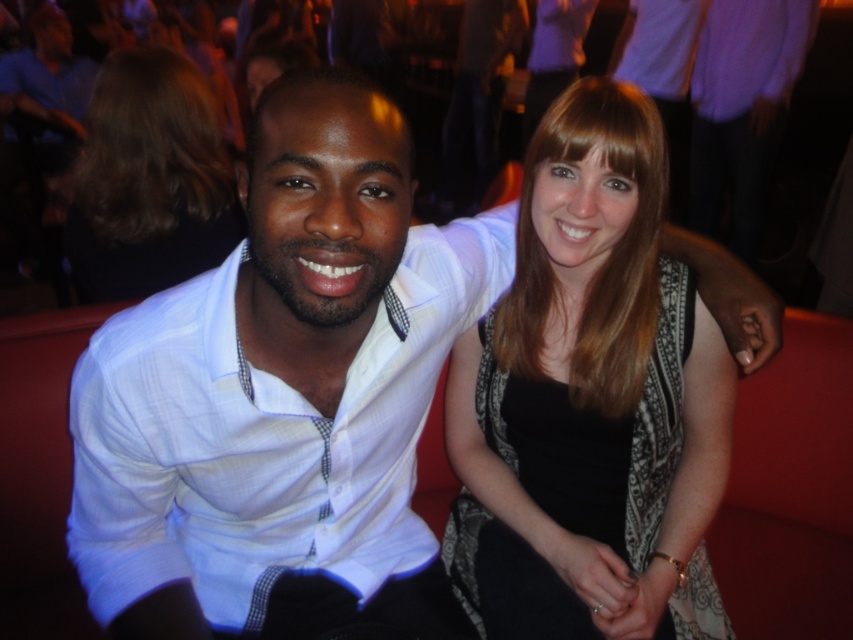
Question: Does black textured dress at center lie behind white textured shirt at left?

Choices:
 (A) no
 (B) yes

Answer: (B)

Question: Which object appears farthest from the camera in this image?

Choices:
 (A) brown hair at upper left
 (B) black textured dress at center
 (C) white textured shirt at left

Answer: (A)

Question: In this image, where is black textured dress at center located relative to white textured shirt at left?

Choices:
 (A) right
 (B) left

Answer: (A)

Question: Considering the real-world distances, which object is closest to the white textured shirt at left?

Choices:
 (A) brown hair at upper left
 (B) black textured dress at center

Answer: (B)

Question: In this image, where is white textured shirt at left located relative to brown hair at upper left?

Choices:
 (A) above
 (B) below

Answer: (B)

Question: Based on their relative distances, which object is nearer to the brown hair at upper left?

Choices:
 (A) white textured shirt at left
 (B) black textured dress at center

Answer: (A)